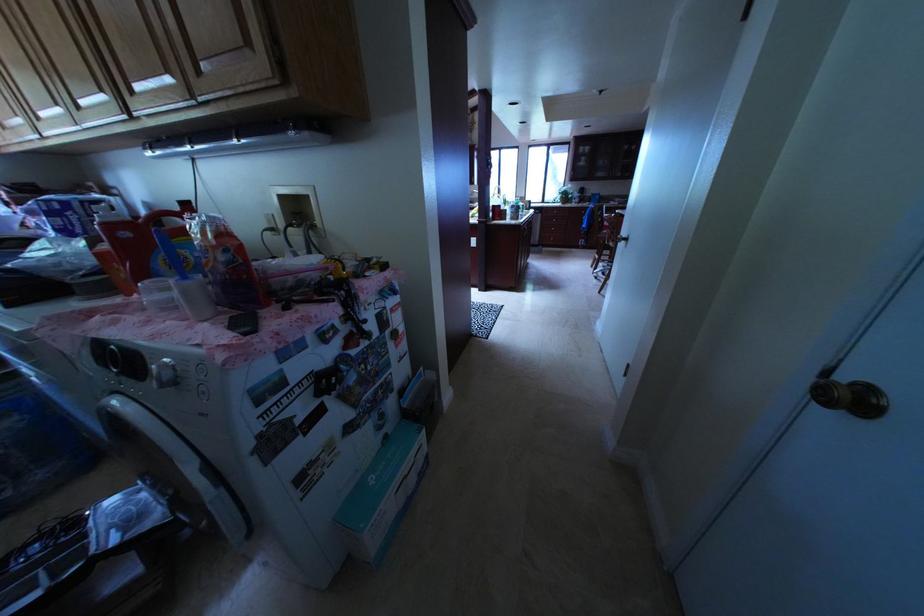
Where would you pull the drawer handle? Please return your answer as a coordinate pair (x, y).

(555, 213)